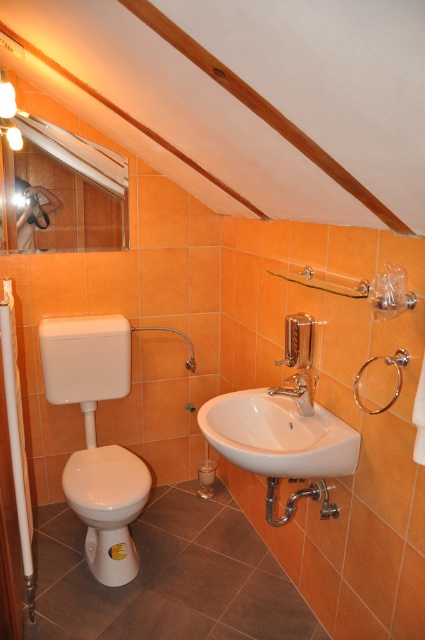
Question: Which point is closer to the camera?

Choices:
 (A) (272, 388)
 (B) (98, 504)
 (C) (254, 444)
 (D) (14, 464)

Answer: (D)

Question: Can you confirm if wooden beam at upper center is positioned to the left of white plastic grab bar at left?

Choices:
 (A) yes
 (B) no

Answer: (B)

Question: Does wooden beam at upper center appear over polished chrome faucet at center?

Choices:
 (A) yes
 (B) no

Answer: (A)

Question: Which object is farther from the camera taking this photo?

Choices:
 (A) white glossy bidet at lower left
 (B) polished chrome faucet at center
 (C) white glossy sink at center

Answer: (A)

Question: Which point is closer to the camera?

Choices:
 (A) polished chrome faucet at center
 (B) white glossy sink at center
 (C) white glossy bidet at lower left
 (D) wooden beam at upper center

Answer: (D)

Question: Is white glossy bidet at lower left to the right of white plastic grab bar at left from the viewer's perspective?

Choices:
 (A) yes
 (B) no

Answer: (A)